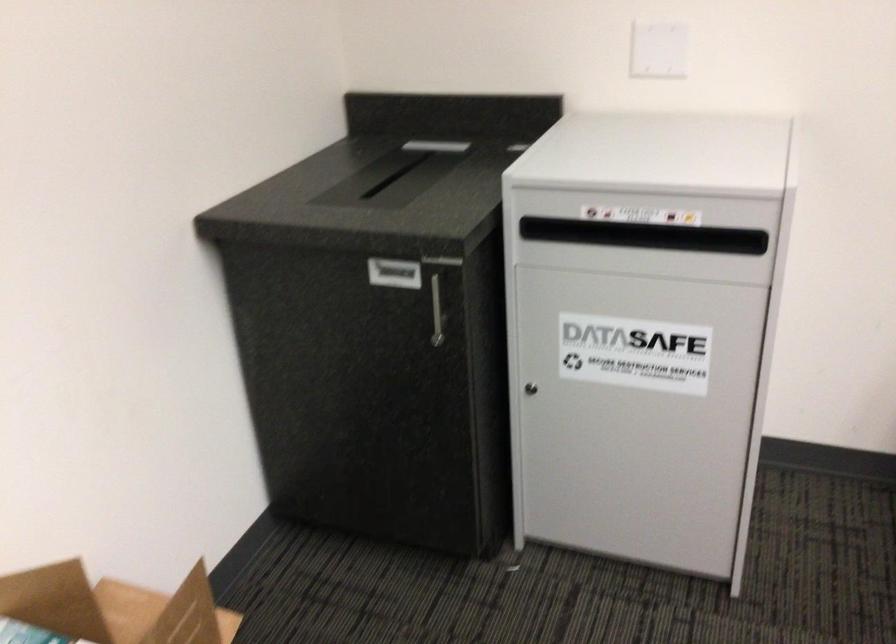
In order to click on black bin slot in this screenshot , I will do `click(644, 236)`.